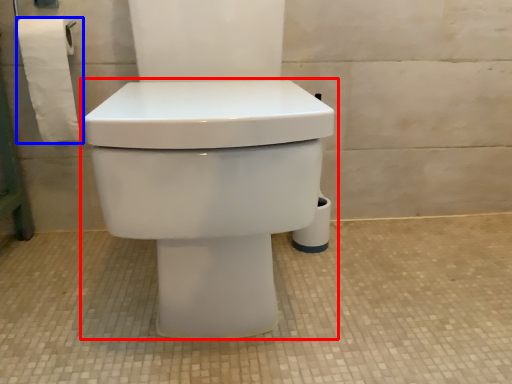
Question: Among these objects, which one is farthest to the camera, toilet (highlighted by a red box) or toilet paper (highlighted by a blue box)?

Choices:
 (A) toilet
 (B) toilet paper

Answer: (B)